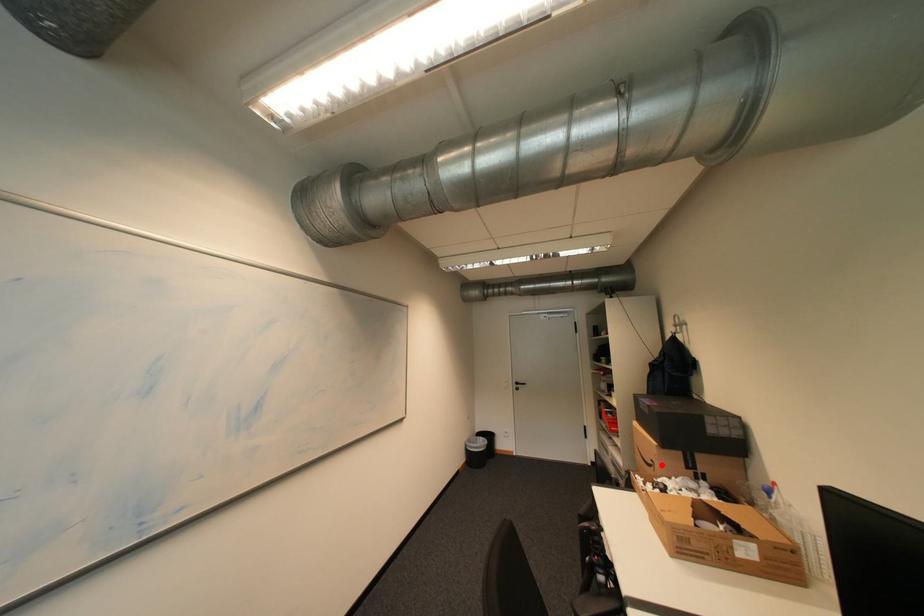
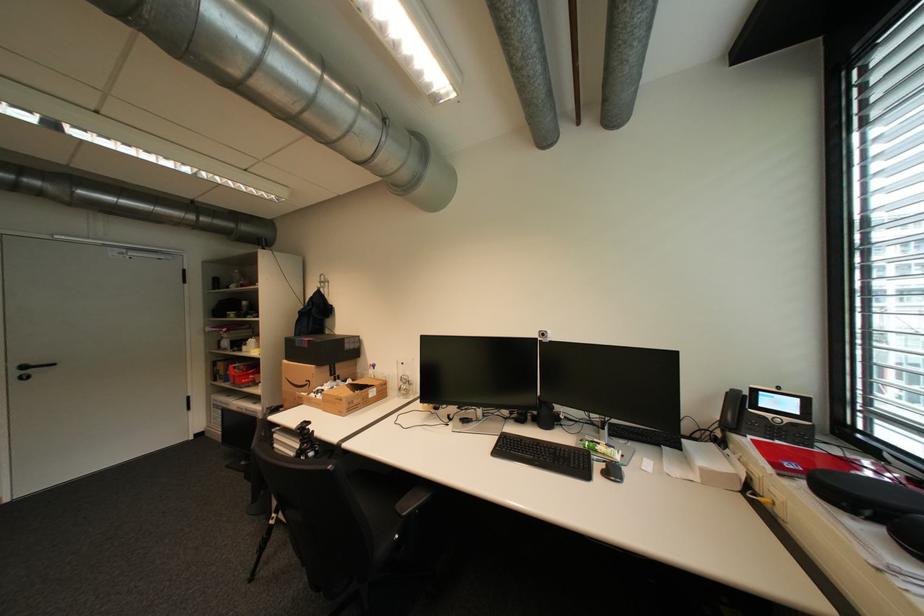
Locate, in the second image, the point that corresponds to the highlighted location in the first image.

(317, 383)